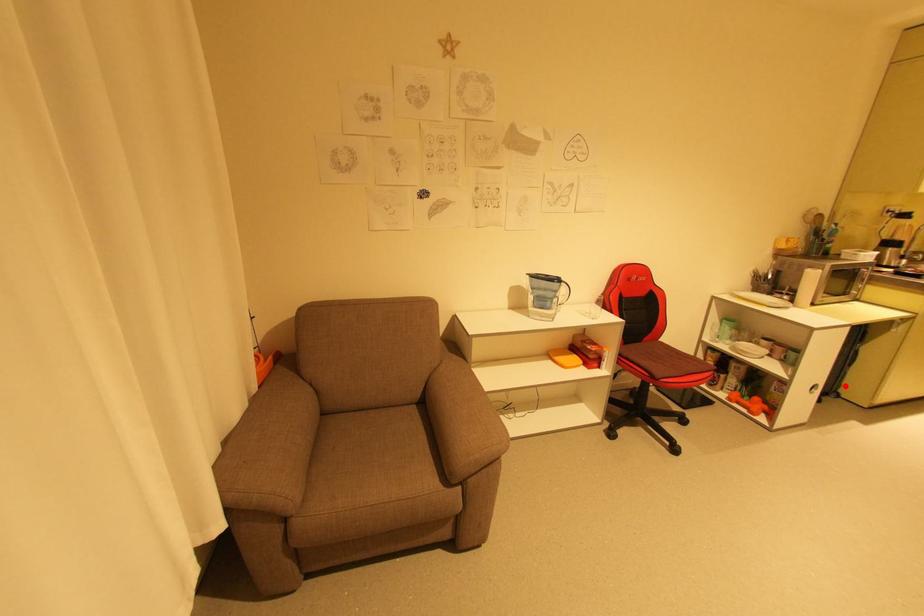
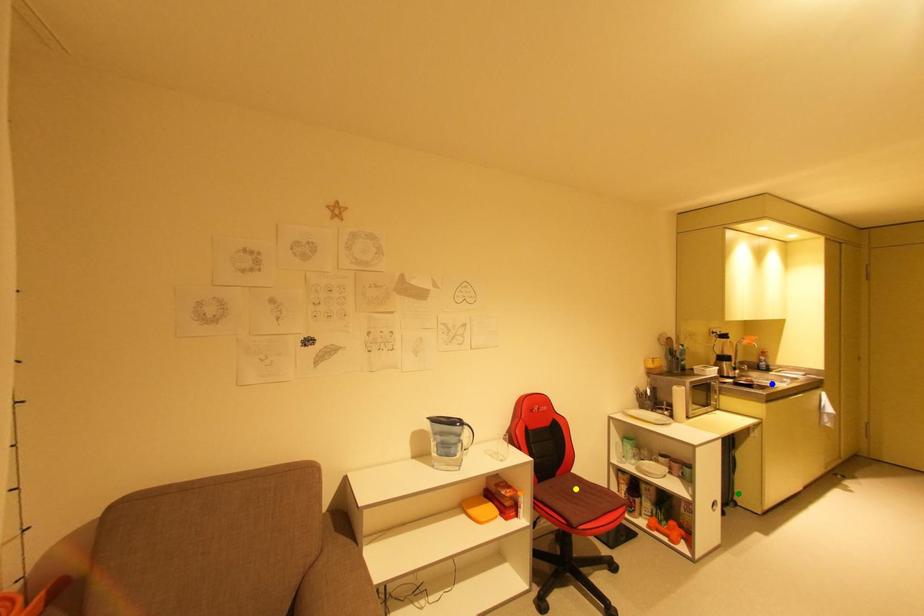
Question: I am providing you with two images of the same scene from different viewpoints. A red point is marked on the first image. You are given multiple points on the second image. Which spot in image 2 lines up with the point in image 1?

Choices:
 (A) green point
 (B) blue point
 (C) yellow point

Answer: (A)